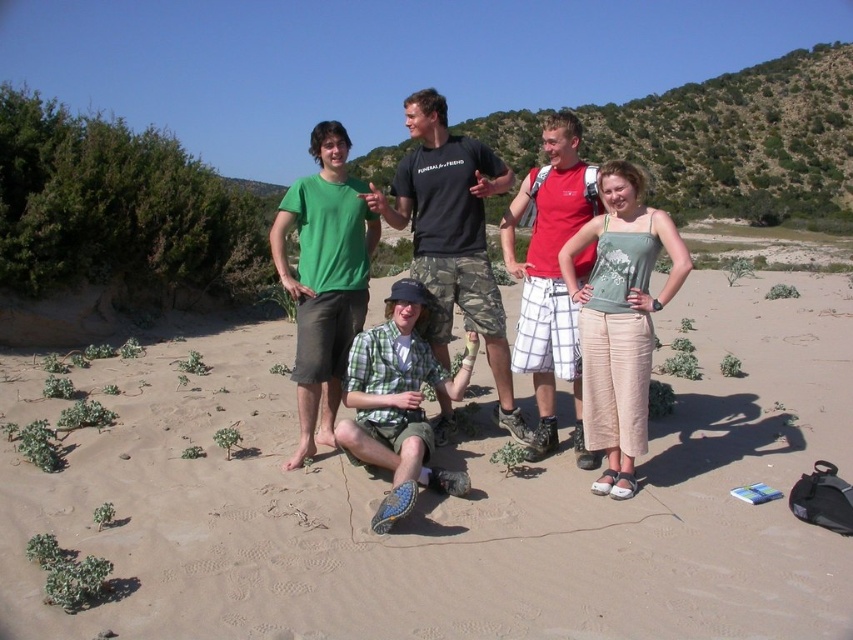
Is beige sandy beach at center taller than black camo shorts at center?

Incorrect, beige sandy beach at center's height is not larger of black camo shorts at center's.

Between point (592, 637) and point (440, 182), which one is positioned behind?

The point (440, 182) is more distant.

Does point (369, 582) come in front of point (479, 228)?

Yes, it is.

Identify the location of beige sandy beach at center. This screenshot has width=853, height=640. (456, 504).

From the picture: Which of these two, beige sandy beach at center or red plaid shorts at center, stands shorter?

beige sandy beach at center

Based on the photo, is beige sandy beach at center behind red plaid shorts at center?

No, it is in front of red plaid shorts at center.

Locate an element on the screen. This screenshot has width=853, height=640. beige sandy beach at center is located at coordinates (456, 504).

Identify the location of beige sandy beach at center. Image resolution: width=853 pixels, height=640 pixels. (456, 504).

Which is behind, point (640, 380) or point (576, 147)?

The point (576, 147) is more distant.

Can you confirm if light green fabric tank top at center is thinner than red plaid shorts at center?

Correct, light green fabric tank top at center's width is less than red plaid shorts at center's.

The image size is (853, 640). What are the coordinates of `light green fabric tank top at center` in the screenshot? It's located at (619, 317).